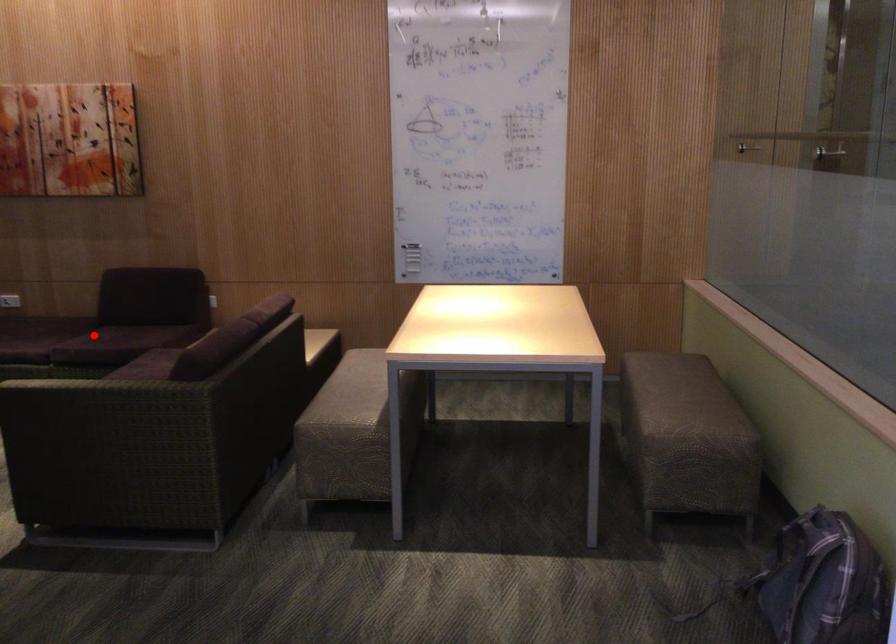
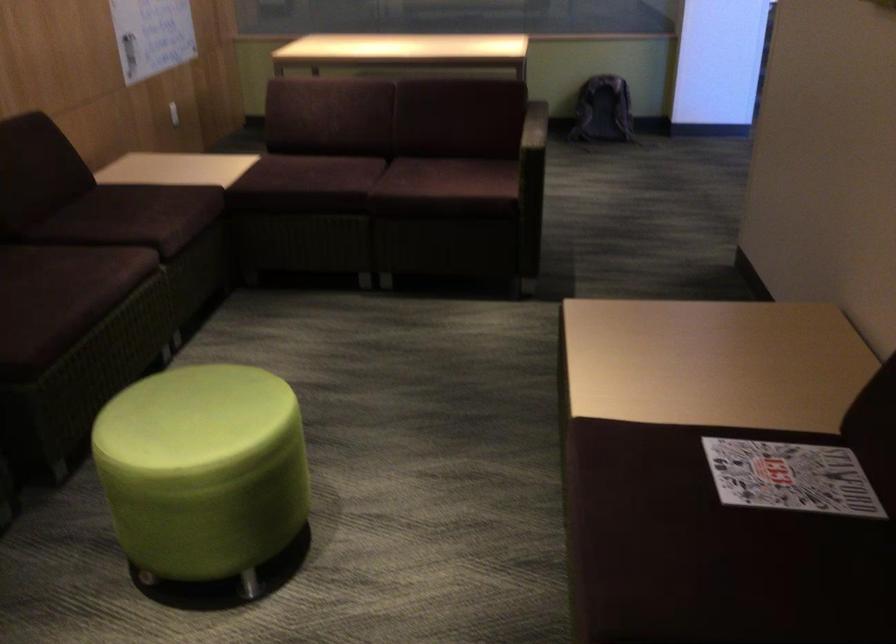
Question: I am providing you with two images of the same scene from different viewpoints. Given a red point in image1, look at the same physical point in image2. Is it:

Choices:
 (A) Closer to the viewpoint
 (B) Farther from the viewpoint

Answer: (A)